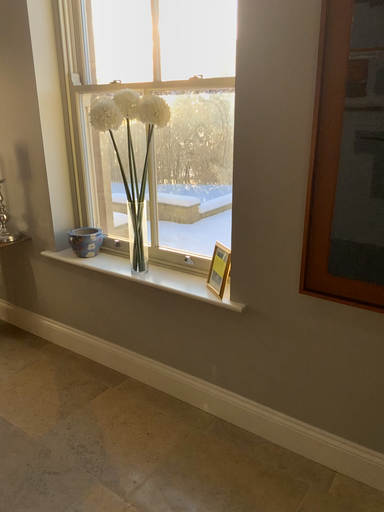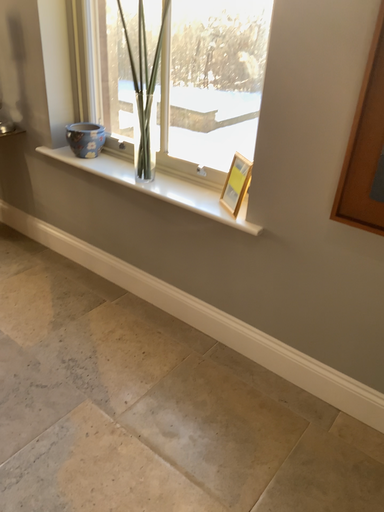
Question: How did the camera likely rotate when shooting the video?

Choices:
 (A) rotated upward
 (B) rotated downward

Answer: (B)